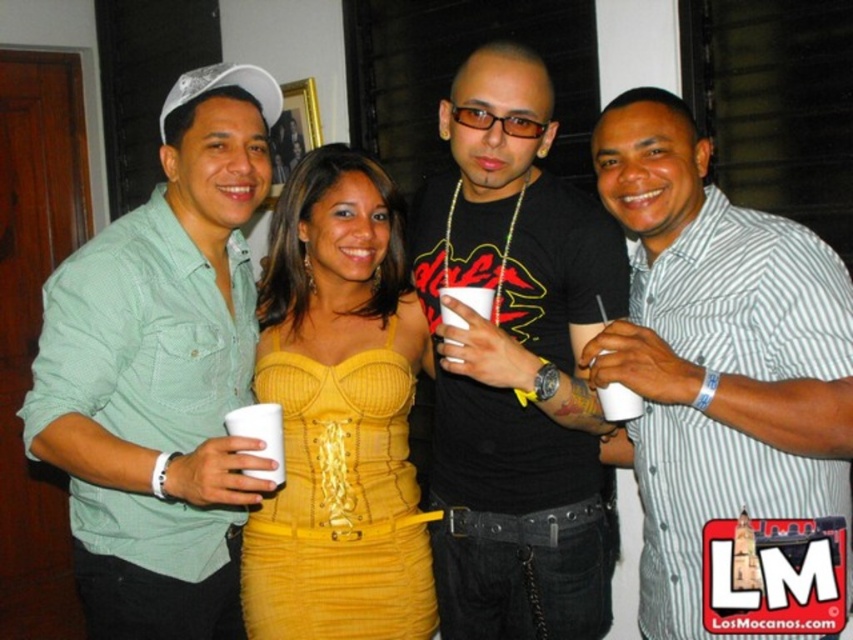
Question: Does green cotton shirt at left appear over white plastic cup at lower left?

Choices:
 (A) no
 (B) yes

Answer: (B)

Question: Where is black matte t-shirt at center located in relation to yellow ribbed fabric dress at center in the image?

Choices:
 (A) left
 (B) right

Answer: (B)

Question: Which point is farther to the camera?

Choices:
 (A) black matte t-shirt at center
 (B) white striped shirt at center

Answer: (A)

Question: Which point is closer to the camera taking this photo?

Choices:
 (A) (260, 436)
 (B) (602, 404)
 (C) (485, 294)
 (D) (395, 508)

Answer: (A)

Question: Does white plastic cup at lower left come in front of white plastic cup at center?

Choices:
 (A) no
 (B) yes

Answer: (B)

Question: Which point appears farthest from the camera in this image?

Choices:
 (A) (837, 417)
 (B) (447, 339)
 (C) (616, 388)

Answer: (B)